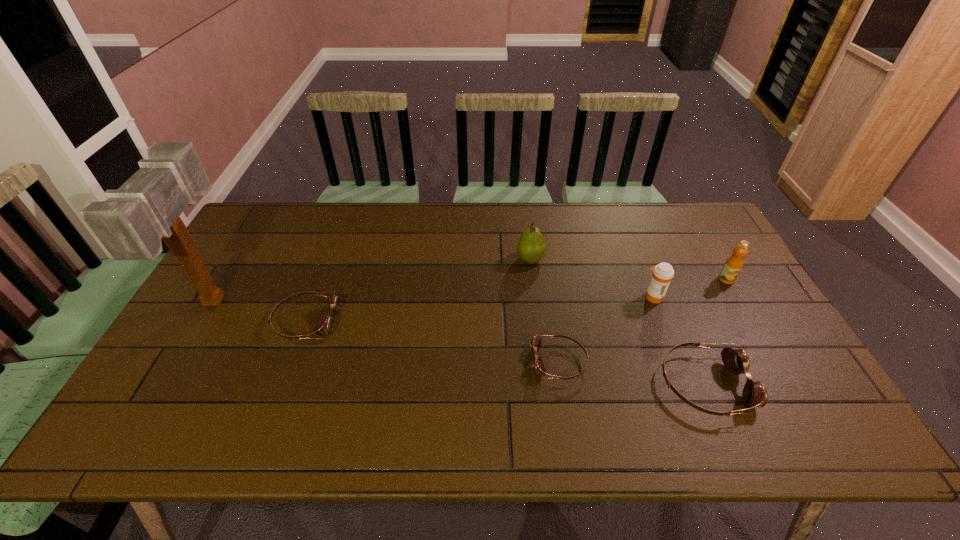
You are a GUI agent. You are given a task and a screenshot of the screen. Output one action in this format:
    pyautogui.click(x=<x>, y=<y>)
    Task: Click on the second shortest goggles
    This screenshot has width=960, height=540.
    Given the screenshot: What is the action you would take?
    pyautogui.click(x=325, y=325)

Where is `the second object from left to right`? Image resolution: width=960 pixels, height=540 pixels. the second object from left to right is located at coordinates (325, 325).

I want to click on the second goggles from right to left, so click(538, 367).

You are a GUI agent. You are given a task and a screenshot of the screen. Output one action in this format:
    pyautogui.click(x=<x>, y=<y>)
    Task: Click on the shortest object
    
    Given the screenshot: What is the action you would take?
    [538, 367]

Locate an element on the screen. This screenshot has width=960, height=540. the rightmost goggles is located at coordinates (736, 361).

Locate an element on the screen. the tallest goggles is located at coordinates (736, 361).

Locate an element on the screen. medicine is located at coordinates (662, 274).

Locate an element on the screen. The width and height of the screenshot is (960, 540). the leftmost object is located at coordinates (130, 224).

Where is `mallet`? This screenshot has height=540, width=960. mallet is located at coordinates (130, 224).

Locate an element on the screen. pear is located at coordinates (531, 247).